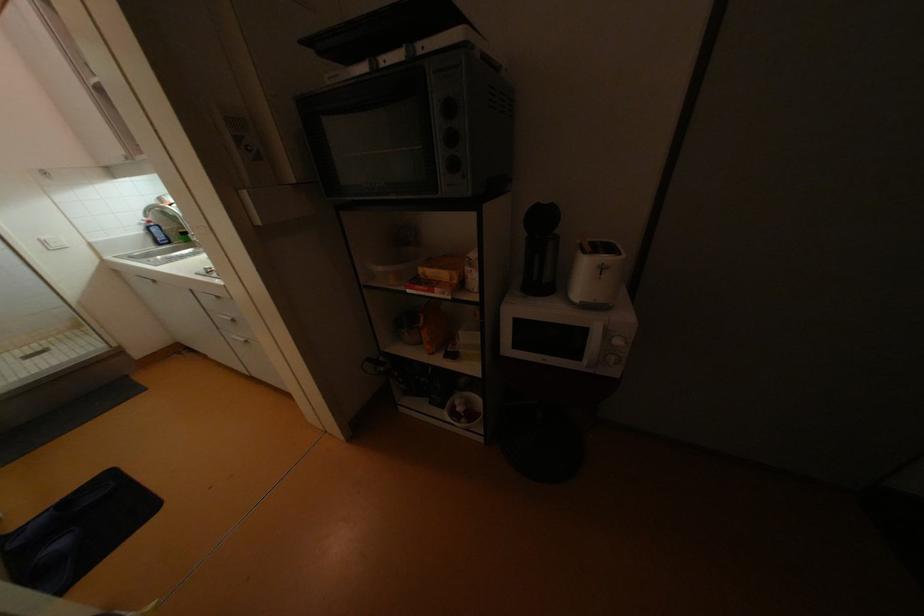
Which object does [53,243] point to?

It corresponds to the white light switch in the image.